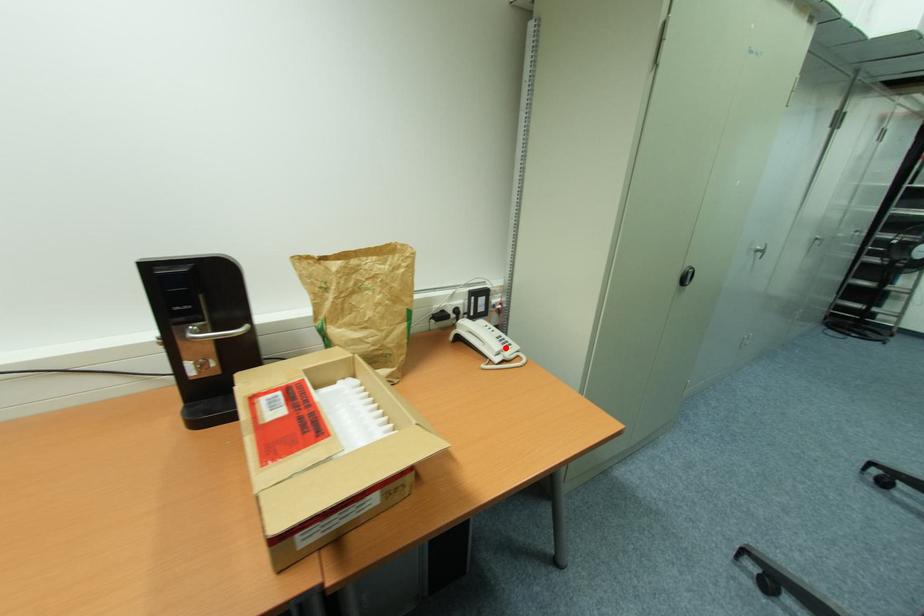
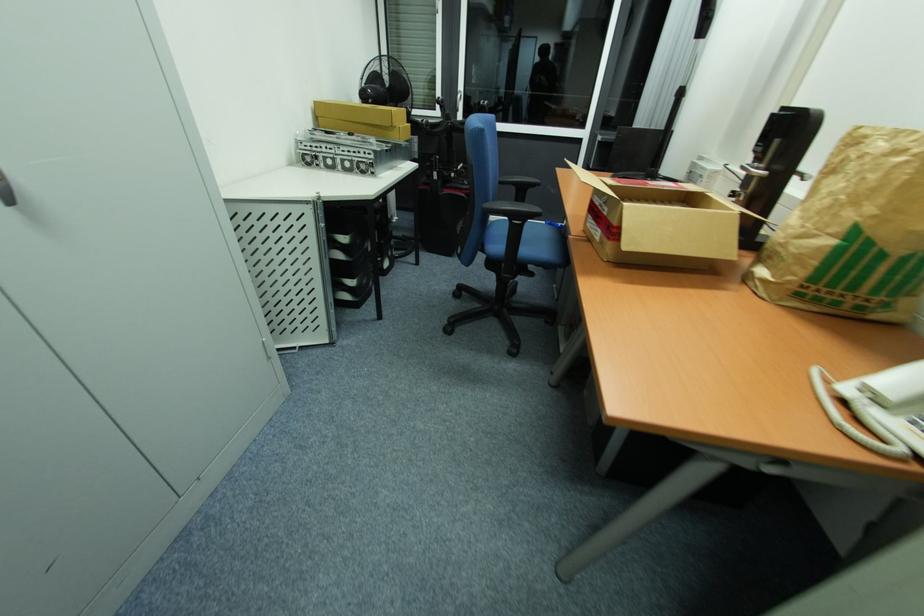
Where in the second image is the point corresponding to the highlighted location from the first image?

(915, 424)